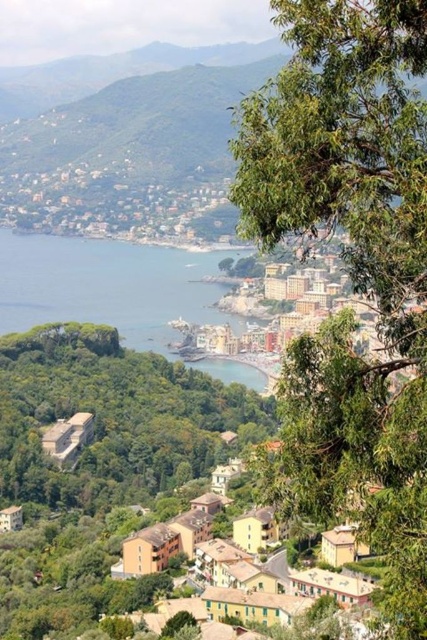
Does green leafy tree at upper right appear on the left side of blue water at center?

In fact, green leafy tree at upper right is to the right of blue water at center.

Between point (404, 310) and point (11, 296), which one is positioned behind?

The point (11, 296) is more distant.

Does point (368, 429) lie in front of point (160, 317)?

Yes, point (368, 429) is closer to viewer.

Locate an element on the screen. green leafy tree at upper right is located at coordinates (351, 262).